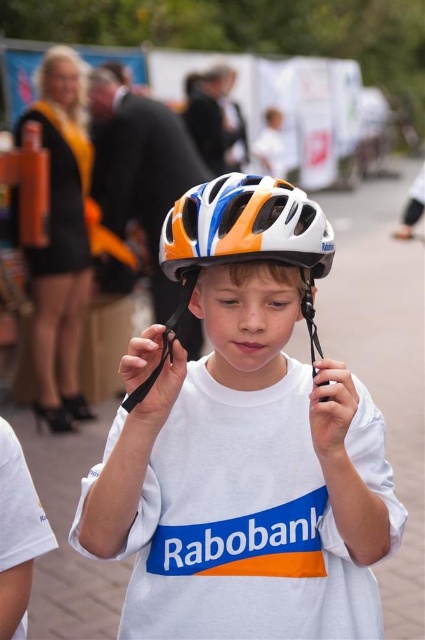
Question: Which point is farther to the camera?

Choices:
 (A) matte black helmet at upper center
 (B) matte black dress at upper left

Answer: (A)

Question: Among these points, which one is farthest from the camera?

Choices:
 (A) (112, 102)
 (B) (266, 176)

Answer: (B)

Question: Does matte black dress at upper left appear on the right side of matte plastic helmet at center?

Choices:
 (A) yes
 (B) no

Answer: (B)

Question: Considering the relative positions of shiny multicolored helmet at center and blonde hair at upper center in the image provided, where is shiny multicolored helmet at center located with respect to blonde hair at upper center?

Choices:
 (A) left
 (B) right

Answer: (B)

Question: Is shiny multicolored helmet at center bigger than matte black dress at upper left?

Choices:
 (A) no
 (B) yes

Answer: (A)

Question: Which of these objects is positioned closest to the matte black dress at upper left?

Choices:
 (A) matte black helmet at upper center
 (B) shiny multicolored helmet at center
 (C) white matte helmet at center
 (D) matte plastic helmet at center

Answer: (A)